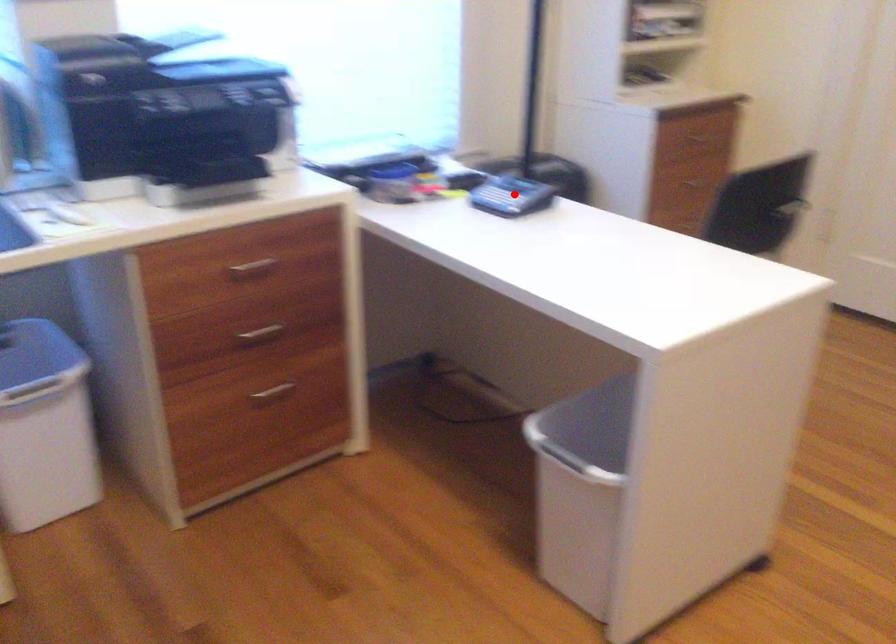
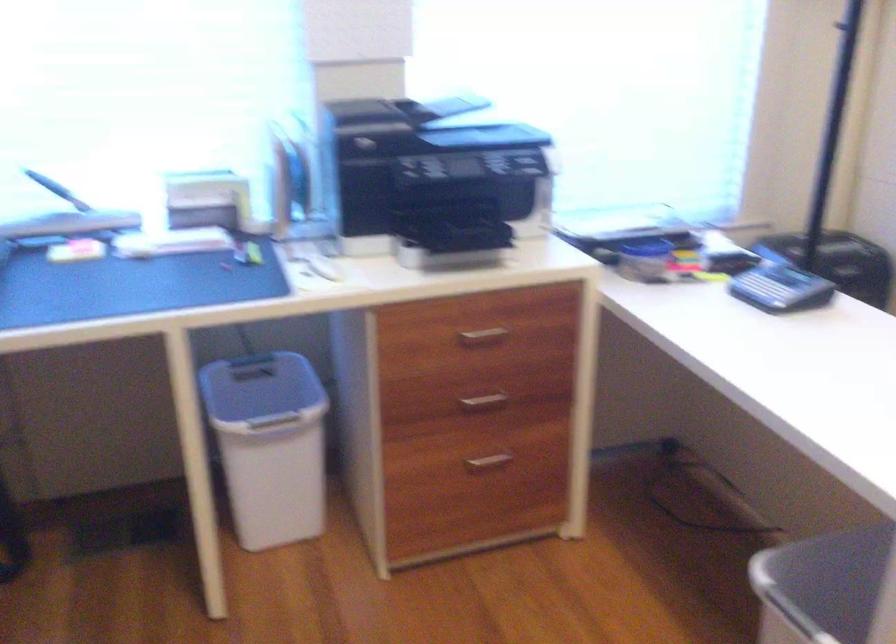
Question: I am providing you with two images of the same scene from different viewpoints. A red point is shown in image1. For the corresponding object point in image2, is it positioned nearer or farther from the camera?

Choices:
 (A) Nearer
 (B) Farther

Answer: (A)